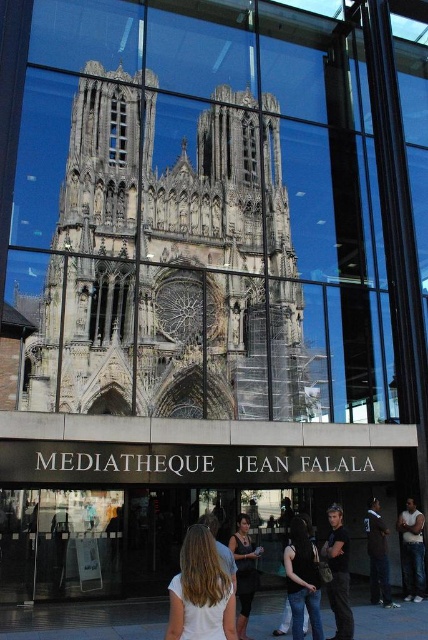
Does dark brown leather jacket at center appear on the left side of clear glass window at center?

In fact, dark brown leather jacket at center is to the right of clear glass window at center.

Which is in front, point (250, 593) or point (122, 154)?

Point (250, 593) is in front.

The image size is (428, 640). Identify the location of dark brown leather jacket at center. (243, 572).

Who is lower down, blonde hair at center or dark brown leather jacket at center?

Positioned lower is blonde hair at center.

Between blonde hair at center and dark brown leather jacket at center, which one has less height?

dark brown leather jacket at center is shorter.

Does point (172, 596) come behind point (241, 596)?

No, (172, 596) is closer to viewer.

Where is `blonde hair at center`? blonde hair at center is located at coordinates (201, 592).

Can you confirm if blonde hair at center is positioned to the right of matte black tank top at center?

No, blonde hair at center is not to the right of matte black tank top at center.

The image size is (428, 640). What do you see at coordinates (201, 592) in the screenshot?
I see `blonde hair at center` at bounding box center [201, 592].

At what (x,y) coordinates should I click in order to perform the action: click on blonde hair at center. Please return your answer as a coordinate pair (x, y). Looking at the image, I should click on (201, 592).